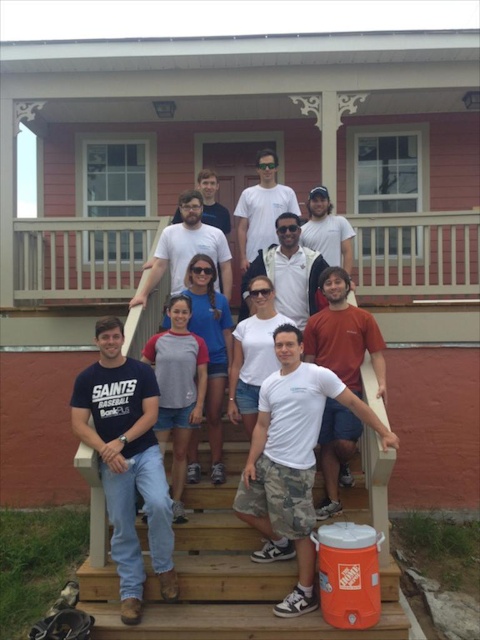
Between dark blue t-shirt at center and white matte sunglasses at center, which one has more height?

dark blue t-shirt at center

Does dark blue t-shirt at center appear on the left side of white matte sunglasses at center?

Correct, you'll find dark blue t-shirt at center to the left of white matte sunglasses at center.

At what (x,y) coordinates should I click in order to perform the action: click on dark blue t-shirt at center. Please return your answer as a coordinate pair (x, y). Looking at the image, I should click on (127, 461).

This screenshot has width=480, height=640. Find the location of `dark blue t-shirt at center`. dark blue t-shirt at center is located at coordinates [x=127, y=461].

Can you confirm if wooden stairs at lower center is positioned above gray/red t-shirt at center?

No.

Does point (244, 444) come in front of point (200, 340)?

No, (244, 444) is further to viewer.

Where is `wooden stairs at lower center`? The height and width of the screenshot is (640, 480). wooden stairs at lower center is located at coordinates (239, 566).

What do you see at coordinates (418, 257) in the screenshot? The height and width of the screenshot is (640, 480). I see `white wooden railing at upper center` at bounding box center [418, 257].

Is white wooden railing at upper center below dark blue t-shirt at center?

Incorrect, white wooden railing at upper center is not positioned below dark blue t-shirt at center.

Which is in front, point (124, 268) or point (169, 545)?

Point (169, 545) is in front.

You are a GUI agent. You are given a task and a screenshot of the screen. Output one action in this format:
    pyautogui.click(x=<x>, y=<y>)
    Task: Click on the white wooden railing at upper center
    The height and width of the screenshot is (640, 480).
    Given the screenshot: What is the action you would take?
    pyautogui.click(x=418, y=257)